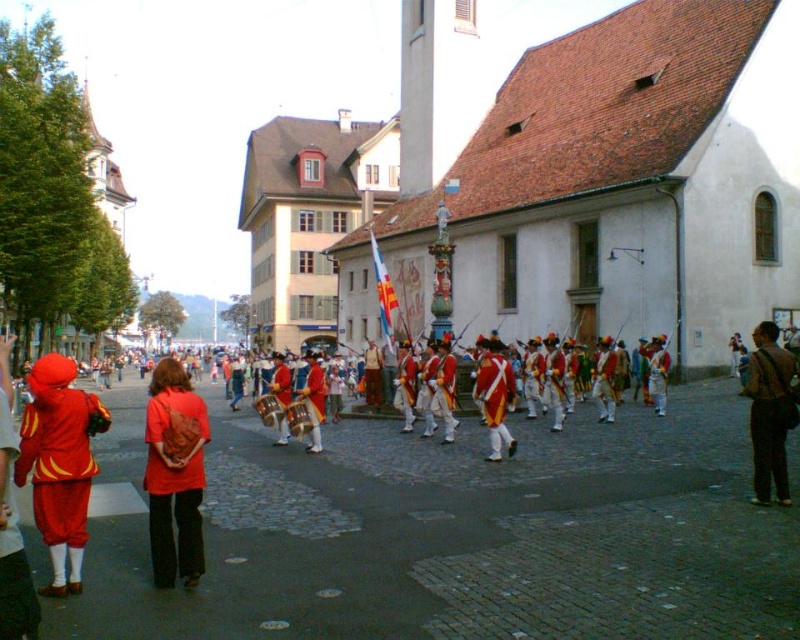
Question: Is red uniformed soldiers at center bigger than brown leather jacket at lower right?

Choices:
 (A) yes
 (B) no

Answer: (A)

Question: Is the position of matte red shirt at center less distant than that of brown leather jacket at lower right?

Choices:
 (A) no
 (B) yes

Answer: (B)

Question: Among these objects, which one is farthest from the camera?

Choices:
 (A) matte red shirt at center
 (B) matte red costume at left
 (C) brown leather jacket at lower right

Answer: (C)

Question: Which point is farther to the camera?

Choices:
 (A) matte red costume at left
 (B) matte red shirt at center
 (C) brown leather jacket at lower right

Answer: (C)

Question: Which object appears closest to the camera in this image?

Choices:
 (A) brown leather jacket at lower right
 (B) matte red shirt at center

Answer: (B)

Question: Does red uniformed soldiers at center have a greater width compared to matte red shirt at center?

Choices:
 (A) yes
 (B) no

Answer: (A)